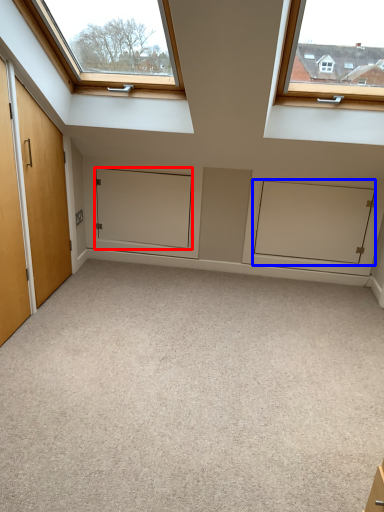
Question: Which object is further to the camera taking this photo, door (highlighted by a red box) or cabinetry (highlighted by a blue box)?

Choices:
 (A) door
 (B) cabinetry

Answer: (A)